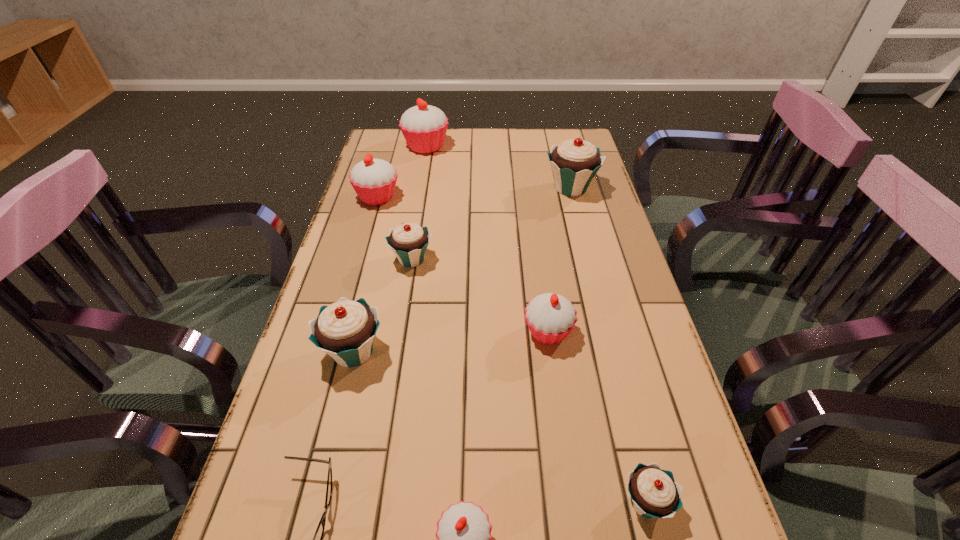
This screenshot has height=540, width=960. I want to click on blank space that satisfies the following two spatial constraints: 1. on the front side of the smallest teal cupcake; 2. on the right side of the second farthest teal cupcake, so click(372, 502).